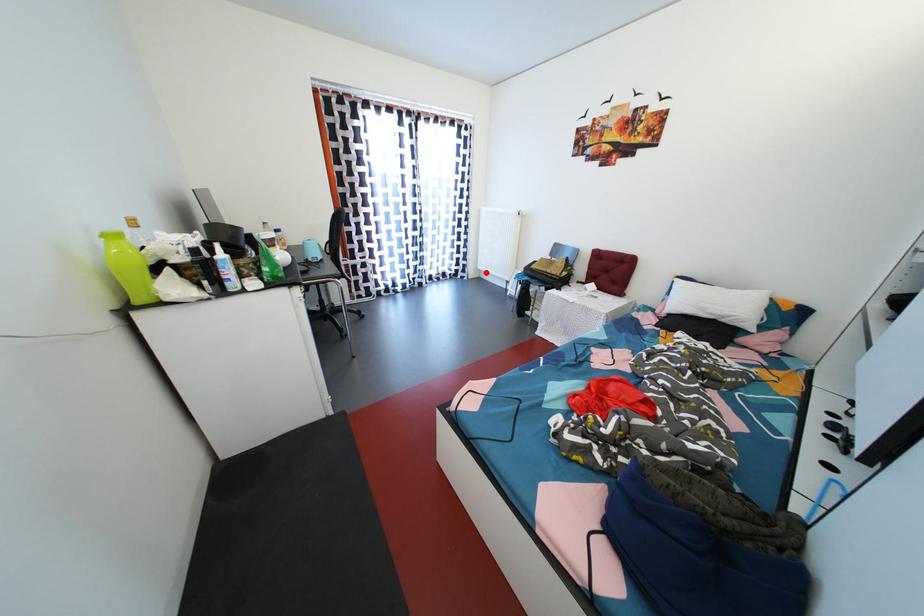
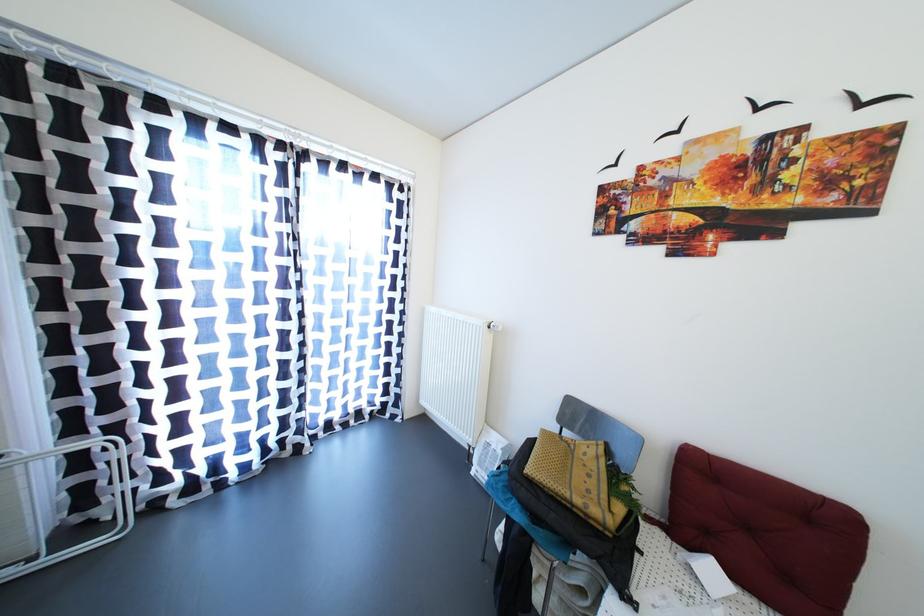
Where in the second image is the point corresponding to the highlighted location from the first image?

(430, 407)